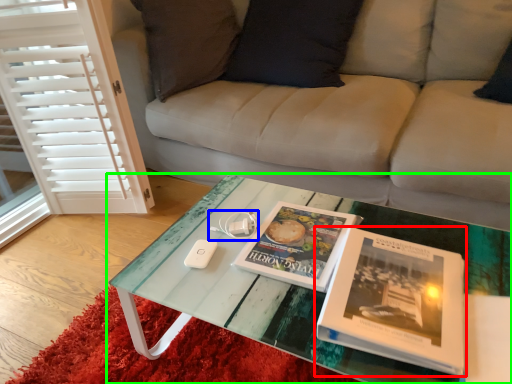
Question: Which is farther away from book (highlighted by a red box)? game controller (highlighted by a blue box) or coffee table (highlighted by a green box)?

Choices:
 (A) game controller
 (B) coffee table

Answer: (A)